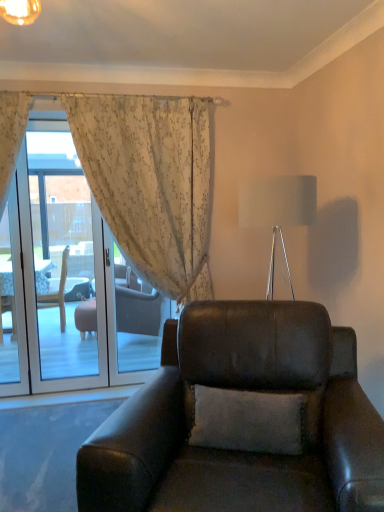
Describe the element at coordinates (277, 210) in the screenshot. I see `white fabric lampshade at upper center` at that location.

You are a GUI agent. You are given a task and a screenshot of the screen. Output one action in this format:
    pyautogui.click(x=<x>, y=<y>)
    Task: Click on the floral sheer curtain at upper left
    
    Given the screenshot: What is the action you would take?
    pyautogui.click(x=151, y=183)

What do you see at coordinates (242, 419) in the screenshot? The width and height of the screenshot is (384, 512). I see `matte black leather armchair at center` at bounding box center [242, 419].

What are the coordinates of `white fabric lampshade at upper center` in the screenshot? It's located at (277, 210).

Is transparent glass screen door at left inside or outside of matte black leather armchair at center?

The correct answer is: outside.

Does transparent glass screen door at left come behind matte black leather armchair at center?

That is True.

Considering the positions of points (58, 134) and (338, 405), is point (58, 134) farther from camera compared to point (338, 405)?

Yes.

Considering the sizes of objects transparent glass screen door at left and matte black leather armchair at center in the image provided, who is shorter, transparent glass screen door at left or matte black leather armchair at center?

matte black leather armchair at center.

From the image's perspective, relative to matte black leather armchair at center, is floral sheer curtain at upper left above or below?

Clearly, from the image's perspective, floral sheer curtain at upper left is above matte black leather armchair at center.

Is floral sheer curtain at upper left not within matte black leather armchair at center?

floral sheer curtain at upper left is positioned outside matte black leather armchair at center.

How far apart are floral sheer curtain at upper left and matte black leather armchair at center?

They are 4.21 feet apart.

Is floral sheer curtain at upper left in front of matte black leather armchair at center?

No, floral sheer curtain at upper left is behind matte black leather armchair at center.

In the image, is floral sheer curtain at upper left positioned in front of or behind white fabric lampshade at upper center?

Clearly, floral sheer curtain at upper left is behind white fabric lampshade at upper center.

Is point (171, 247) less distant than point (272, 208)?

No, (171, 247) is further to viewer.

How much distance is there between floral sheer curtain at upper left and white fabric lampshade at upper center?

floral sheer curtain at upper left and white fabric lampshade at upper center are 36.55 inches apart from each other.

What are the coordinates of `curtain behind the white fabric lampshade at upper center` in the screenshot? It's located at (151, 183).

I want to click on curtain above the matte black leather armchair at center (from a real-world perspective), so click(x=151, y=183).

In the scene shown: Between matte black leather armchair at center and floral sheer curtain at upper left, which one has less height?

matte black leather armchair at center.

Is the depth of matte black leather armchair at center less than that of floral sheer curtain at upper left?

Yes, matte black leather armchair at center is in front of floral sheer curtain at upper left.

From a real-world perspective, which is physically below, matte black leather armchair at center or floral sheer curtain at upper left?

matte black leather armchair at center.

Is white fabric lampshade at upper center smaller than transparent glass screen door at left?

Actually, white fabric lampshade at upper center might be larger than transparent glass screen door at left.

Which of these two, white fabric lampshade at upper center or transparent glass screen door at left, stands taller?

Standing taller between the two is transparent glass screen door at left.

Between white fabric lampshade at upper center and transparent glass screen door at left, which one has larger width?

white fabric lampshade at upper center is wider.

From the image's perspective, which is below, transparent glass screen door at left or floral sheer curtain at upper left?

transparent glass screen door at left appears lower in the image.

In the scene shown: Does transparent glass screen door at left turn towards floral sheer curtain at upper left?

A: No, transparent glass screen door at left is not facing towards floral sheer curtain at upper left.

Does transparent glass screen door at left come in front of floral sheer curtain at upper left?

No, it is behind floral sheer curtain at upper left.

Is transparent glass screen door at left smaller than floral sheer curtain at upper left?

Indeed, transparent glass screen door at left has a smaller size compared to floral sheer curtain at upper left.

Looking at their sizes, would you say matte black leather armchair at center is wider or thinner than white fabric lampshade at upper center?

Clearly, matte black leather armchair at center has more width compared to white fabric lampshade at upper center.

Which object is further away from the camera taking this photo, matte black leather armchair at center or white fabric lampshade at upper center?

white fabric lampshade at upper center is further from the camera.

Can you confirm if matte black leather armchair at center is smaller than white fabric lampshade at upper center?

Incorrect, matte black leather armchair at center is not smaller in size than white fabric lampshade at upper center.

Is there a large distance between matte black leather armchair at center and white fabric lampshade at upper center?

No.

Where is `chair on the right of transparent glass screen door at left`? Image resolution: width=384 pixels, height=512 pixels. chair on the right of transparent glass screen door at left is located at coordinates (242, 419).

Where is `chair below the floral sheer curtain at upper left (from the image's perspective)`? The width and height of the screenshot is (384, 512). chair below the floral sheer curtain at upper left (from the image's perspective) is located at coordinates (242, 419).

Based on their spatial positions, is white fabric lampshade at upper center or floral sheer curtain at upper left closer to transparent glass screen door at left?

The object closer to transparent glass screen door at left is floral sheer curtain at upper left.

From the image, which object appears to be farther from white fabric lampshade at upper center, transparent glass screen door at left or matte black leather armchair at center?

Among the two, transparent glass screen door at left is located further to white fabric lampshade at upper center.

Considering their positions, is transparent glass screen door at left positioned closer to matte black leather armchair at center than floral sheer curtain at upper left?

The object closer to matte black leather armchair at center is floral sheer curtain at upper left.

Looking at this image, based on their spatial positions, is matte black leather armchair at center or white fabric lampshade at upper center further from floral sheer curtain at upper left?

matte black leather armchair at center is further to floral sheer curtain at upper left.

In the scene shown: Which object lies nearer to the anchor point floral sheer curtain at upper left, transparent glass screen door at left or matte black leather armchair at center?

Among the two, matte black leather armchair at center is located nearer to floral sheer curtain at upper left.

Considering their positions, is transparent glass screen door at left positioned closer to white fabric lampshade at upper center than floral sheer curtain at upper left?

The object closer to white fabric lampshade at upper center is floral sheer curtain at upper left.

Considering their positions, is transparent glass screen door at left positioned closer to floral sheer curtain at upper left than white fabric lampshade at upper center?

Among the two, white fabric lampshade at upper center is located nearer to floral sheer curtain at upper left.

Looking at the image, which one is located further to transparent glass screen door at left, matte black leather armchair at center or floral sheer curtain at upper left?

The object further to transparent glass screen door at left is matte black leather armchair at center.

Locate an element on the screen. The width and height of the screenshot is (384, 512). curtain located between matte black leather armchair at center and transparent glass screen door at left in the depth direction is located at coordinates (151, 183).

This screenshot has height=512, width=384. I want to click on curtain between transparent glass screen door at left and white fabric lampshade at upper center from left to right, so click(151, 183).

Locate an element on the screen. lamp between matte black leather armchair at center and transparent glass screen door at left in the front-back direction is located at coordinates (277, 210).

The image size is (384, 512). I want to click on lamp between matte black leather armchair at center and floral sheer curtain at upper left from front to back, so (x=277, y=210).